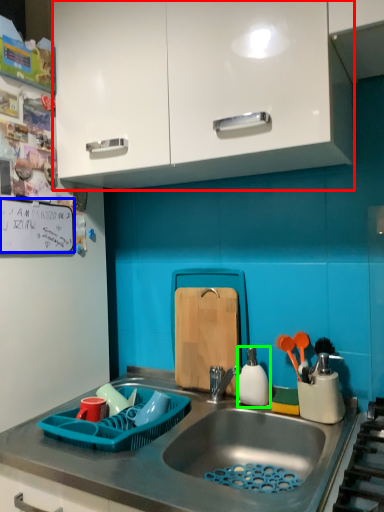
Question: Which object is the farthest from cabinetry (highlighted by a red box)? Choose among these: bulletin board (highlighted by a blue box) or appliance (highlighted by a green box).

Choices:
 (A) bulletin board
 (B) appliance

Answer: (B)